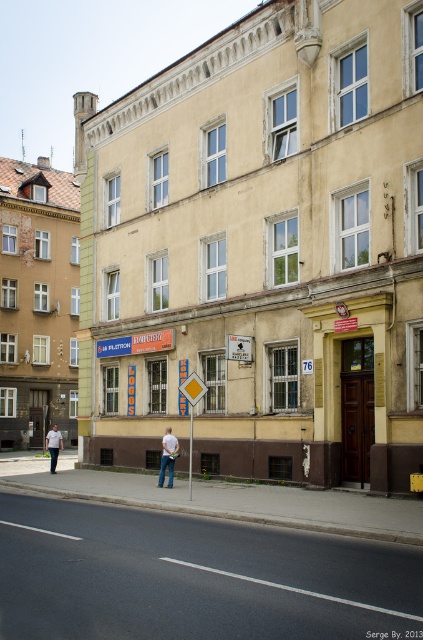
Question: Which object is the farthest from the white fabric shirt at center?

Choices:
 (A) white cotton shirt at center
 (B) metallic rectangular sign at center

Answer: (A)

Question: Can you confirm if metallic rectangular sign at center is positioned to the left of white cotton shirt at center?

Choices:
 (A) no
 (B) yes

Answer: (A)

Question: Considering the real-world distances, which object is closest to the brown wooden door at center?

Choices:
 (A) white cotton shirt at center
 (B) white fabric shirt at center
 (C) metallic rectangular sign at center

Answer: (C)

Question: Which of the following is the farthest from the observer?

Choices:
 (A) (52, 464)
 (B) (335, 316)
 (C) (165, 451)
 (D) (230, 342)

Answer: (A)

Question: Does brown wooden door at center have a lesser width compared to metallic rectangular sign at center?

Choices:
 (A) yes
 (B) no

Answer: (B)

Question: Where is brown wooden door at center located in relation to metallic rectangular sign at center in the image?

Choices:
 (A) below
 (B) above

Answer: (A)